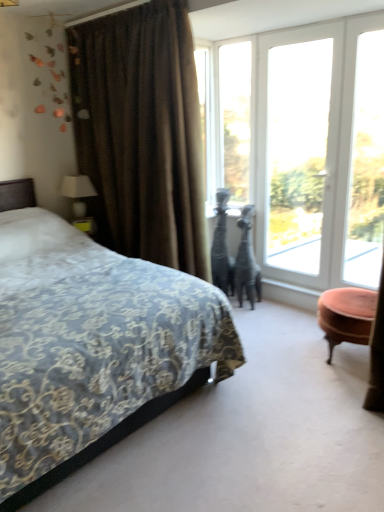
Where is `vacant space underneath velvet pink ottoman at right (from a real-world perspective)`? vacant space underneath velvet pink ottoman at right (from a real-world perspective) is located at coordinates (342, 357).